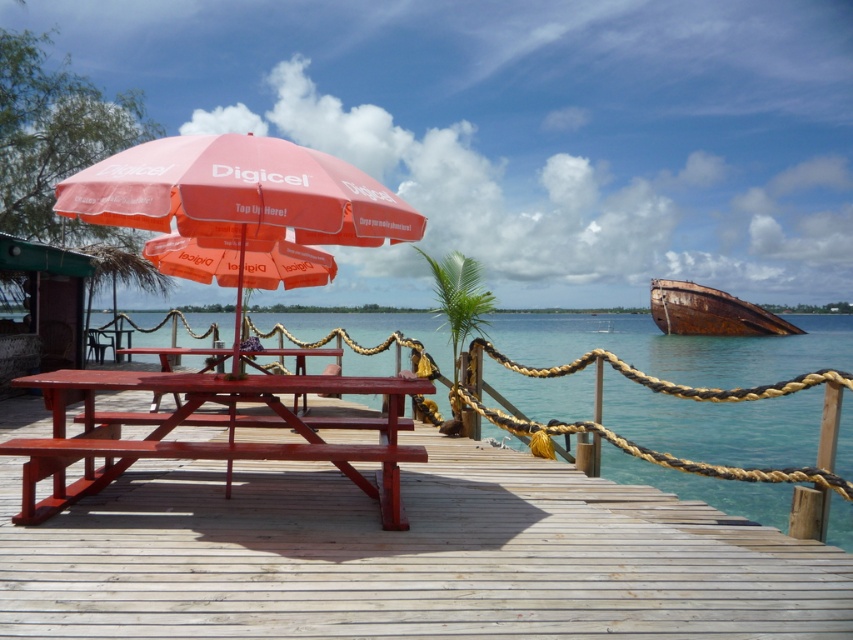
Question: Which of the following is the closest to the observer?

Choices:
 (A) (712, 317)
 (B) (222, 250)
 (C) (624, 410)

Answer: (B)

Question: Among these points, which one is farthest from the camera?

Choices:
 (A) (161, 248)
 (B) (218, 349)

Answer: (B)

Question: Which object is positioned closest to the smooth wood table at center?

Choices:
 (A) clear blue water at center
 (B) orange fabric umbrella at center
 (C) matte red picnic table at center
 (D) rusty metal boat at right

Answer: (B)

Question: Is matte red picnic table at center to the right of rusty metal boat at right from the viewer's perspective?

Choices:
 (A) yes
 (B) no

Answer: (B)

Question: Does matte red picnic table at center come behind orange fabric umbrella at center?

Choices:
 (A) no
 (B) yes

Answer: (A)

Question: In this image, where is clear blue water at center located relative to matte red picnic table at center?

Choices:
 (A) above
 (B) below

Answer: (A)